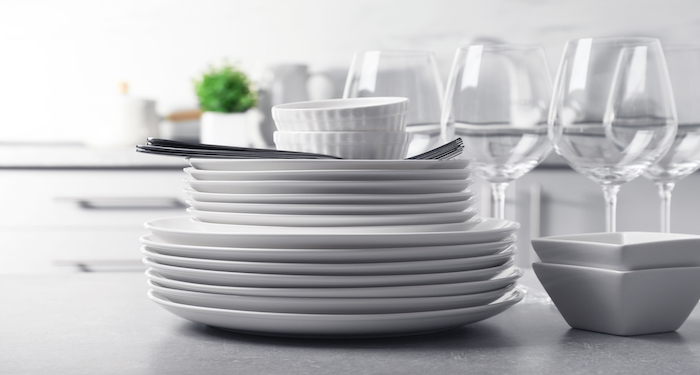
Locate an element on the screen. Image resolution: width=700 pixels, height=375 pixels. handle is located at coordinates (122, 200), (102, 264), (146, 202), (120, 264).